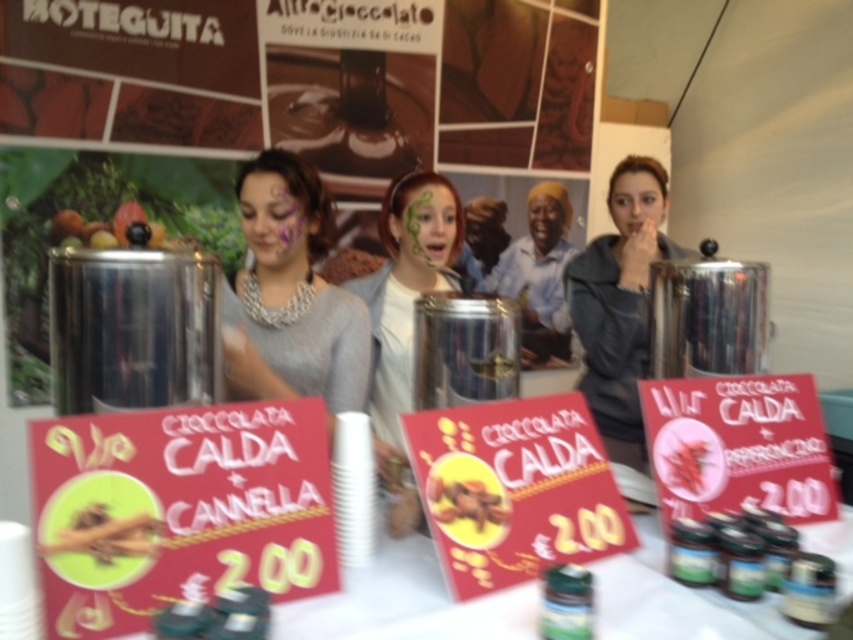
Consider the image. You are standing at the hot chocolate stand and want to know how far you are from the point marked at coordinates point (438,516). Can you determine the distance?

The distance between you and the point (438,516) is 99.29 centimeters.

You are a customer at the hot chocolate stand and want to add toppings to your drink. The vendor offers both the yellow cinnamon sticks at center and the brown matte nuts at center. If you want to choose the taller topping, which one should you pick?

The brown matte nuts at center are taller than the yellow cinnamon sticks at center, so you should choose the brown matte nuts at center.

You are a customer at the hot chocolate stand and want to add a topping. The vendor offers you the yellow cinnamon sticks at center and brown matte nuts at center. If you want the topping with the wider width, which one should you choose?

The brown matte nuts at center are wider than the yellow cinnamon sticks at center, so you should choose the brown matte nuts at center for the wider topping.